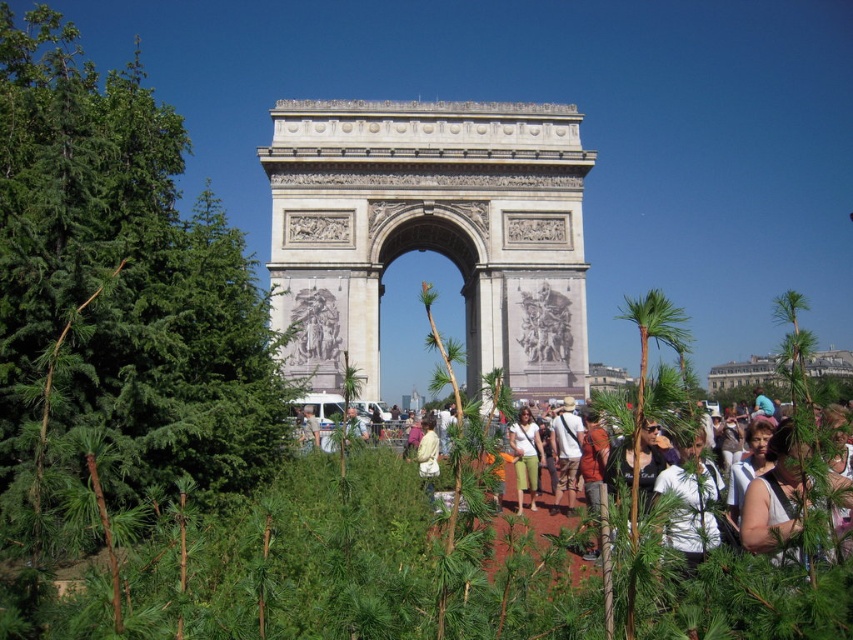
Question: Does green leafy plant at center appear on the left side of matte orange shirt at center?

Choices:
 (A) no
 (B) yes

Answer: (A)

Question: Which point is closer to the camera taking this photo?

Choices:
 (A) (596, 420)
 (B) (534, 493)
 (C) (577, 460)
 (D) (427, 464)

Answer: (D)

Question: Among these points, which one is farthest from the camera?

Choices:
 (A) (595, 467)
 (B) (428, 481)

Answer: (A)

Question: Is green leafy plant at center further to the viewer compared to matte orange shirt at center?

Choices:
 (A) no
 (B) yes

Answer: (A)

Question: Does matte white shirt at center appear over light yellow shirt at center?

Choices:
 (A) yes
 (B) no

Answer: (A)

Question: Based on their relative distances, which object is farther from the green leafy plant at center?

Choices:
 (A) stone relief sculpture at center
 (B) light yellow shirt at center
 (C) khaki cotton shorts at center
 (D) matte white shirt at center

Answer: (B)